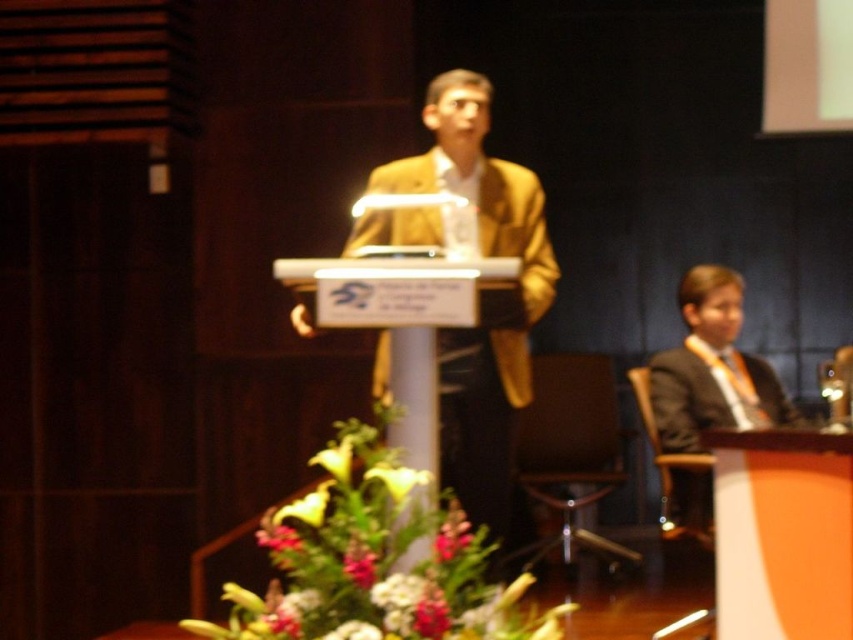
You are organizing a floral arrangement for a formal event. You have a green leafy plant at center and a white glossy lily at center. Which one should you place in a larger pot to match their sizes?

The green leafy plant at center is larger in size than the white glossy lily at center, so you should place the green leafy plant at center in a larger pot to match its size.